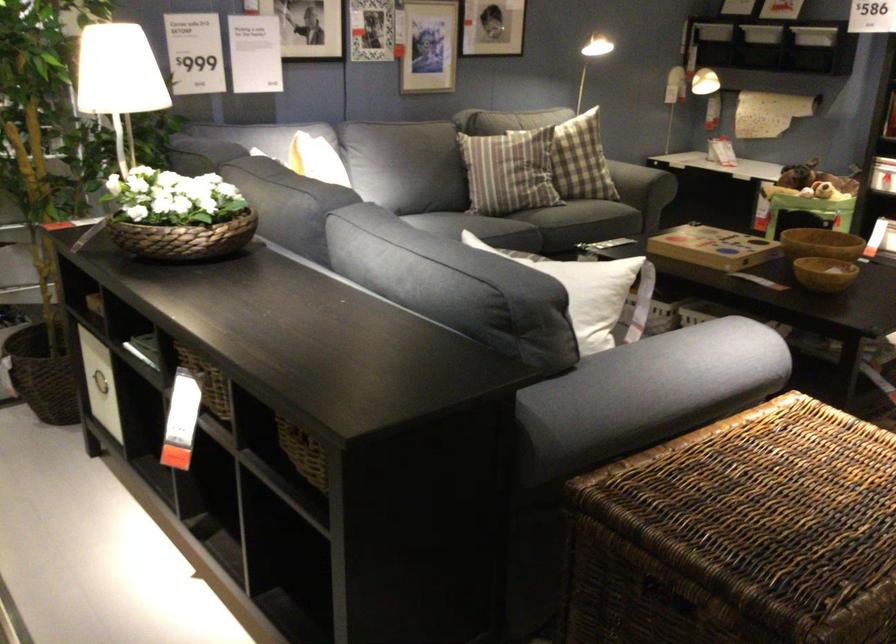
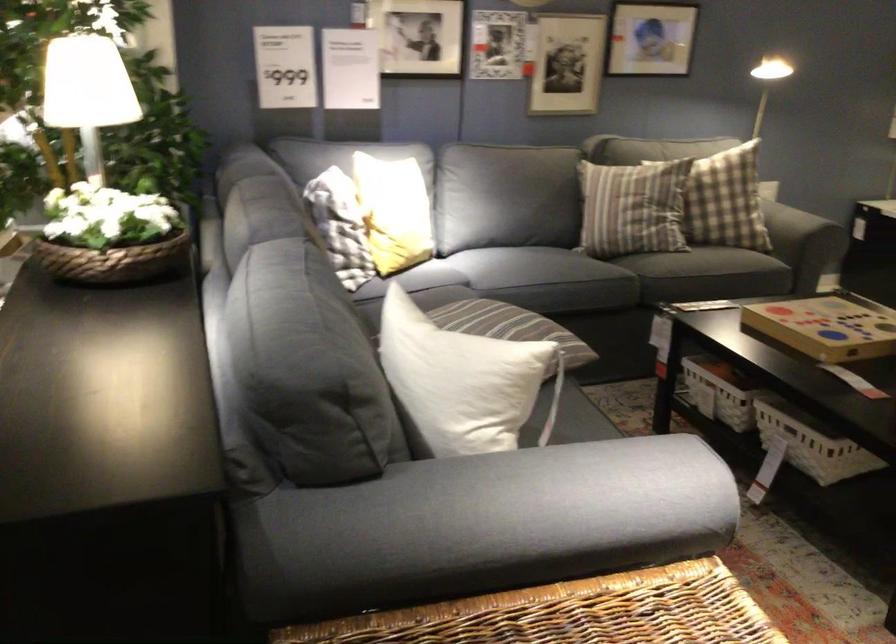
In the second image, find the point that corresponds to point (531, 184) in the first image.

(633, 207)